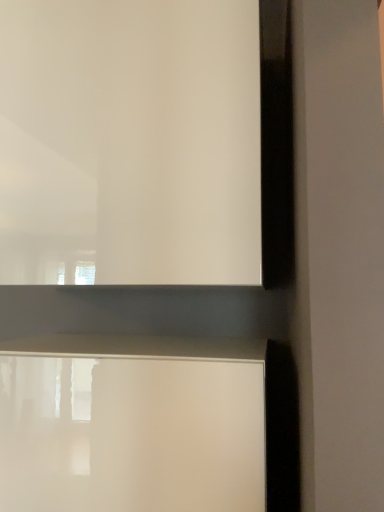
Question: From the image's perspective, is white glossy table at lower center located above or below white glossy window frame at upper center?

Choices:
 (A) above
 (B) below

Answer: (B)

Question: Is white glossy table at lower center wider or thinner than white glossy window frame at upper center?

Choices:
 (A) wide
 (B) thin

Answer: (B)

Question: Considering the positions of white glossy table at lower center and white glossy window frame at upper center in the image, is white glossy table at lower center bigger or smaller than white glossy window frame at upper center?

Choices:
 (A) small
 (B) big

Answer: (A)

Question: Would you say white glossy window frame at upper center is to the left or to the right of white glossy table at lower center in the picture?

Choices:
 (A) right
 (B) left

Answer: (A)

Question: From the image's perspective, is white glossy window frame at upper center above or below white glossy table at lower center?

Choices:
 (A) below
 (B) above

Answer: (B)

Question: In terms of size, does white glossy window frame at upper center appear bigger or smaller than white glossy table at lower center?

Choices:
 (A) big
 (B) small

Answer: (A)

Question: Considering the positions of white glossy window frame at upper center and white glossy table at lower center in the image, is white glossy window frame at upper center taller or shorter than white glossy table at lower center?

Choices:
 (A) tall
 (B) short

Answer: (A)